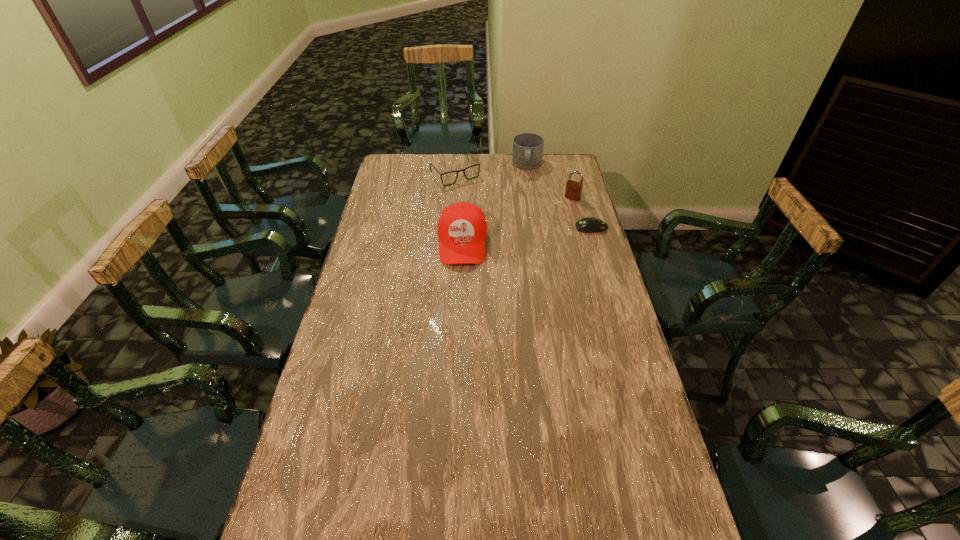
This screenshot has width=960, height=540. What are the coordinates of `baseball cap` in the screenshot? It's located at (462, 227).

Find the location of `the shortest object`. the shortest object is located at coordinates (586, 225).

Where is `the fourth tallest object`? The image size is (960, 540). the fourth tallest object is located at coordinates (430, 163).

The width and height of the screenshot is (960, 540). I want to click on padlock, so click(573, 191).

Identify the location of mug. (527, 153).

Where is `free space located 0.320m on the front panel of the baseball cap`? free space located 0.320m on the front panel of the baseball cap is located at coordinates (458, 339).

At what (x,y) coordinates should I click in order to perform the action: click on free space located 0.260m on the lens of the fourth tallest object. Please return your answer as a coordinate pair (x, y). Looking at the image, I should click on (495, 217).

The image size is (960, 540). In order to click on free space located on the lens of the fourth tallest object in this screenshot , I will do `click(511, 234)`.

You are a GUI agent. You are given a task and a screenshot of the screen. Output one action in this format:
    pyautogui.click(x=<x>, y=<y>)
    Task: Click on the free region located on the lens of the fourth tallest object
    
    Given the screenshot: What is the action you would take?
    pyautogui.click(x=498, y=220)

Locate an element on the screen. vacant space located 0.060m on the front-facing side of the padlock is located at coordinates (564, 208).